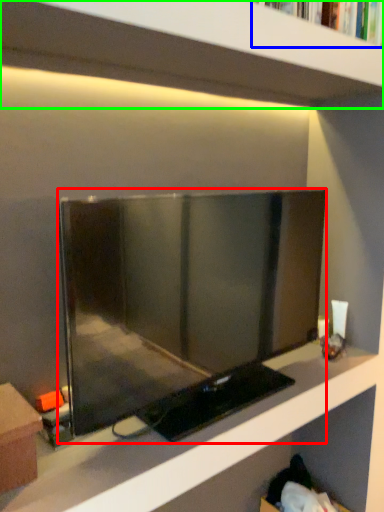
Question: Estimate the real-world distances between objects in this image. Which object is farther from television (highlighted by a red box), book (highlighted by a blue box) or shelf (highlighted by a green box)?

Choices:
 (A) book
 (B) shelf

Answer: (A)